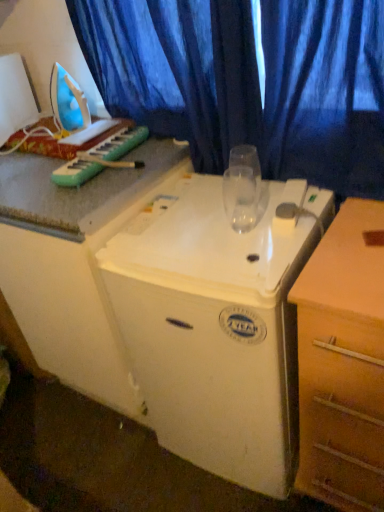
Question: Which direction should I rotate to face white plastic refrigerator at center, the first appliance from the bottom, — up or down?

Choices:
 (A) up
 (B) down

Answer: (B)

Question: Considering the relative sizes of green plastic musical keyboard at upper left and wooden chest of drawers at right in the image provided, is green plastic musical keyboard at upper left shorter than wooden chest of drawers at right?

Choices:
 (A) no
 (B) yes

Answer: (B)

Question: Is green plastic musical keyboard at upper left far away from wooden chest of drawers at right?

Choices:
 (A) yes
 (B) no

Answer: (B)

Question: Can we say green plastic musical keyboard at upper left lies outside wooden chest of drawers at right?

Choices:
 (A) no
 (B) yes

Answer: (B)

Question: Is green plastic musical keyboard at upper left bigger than wooden chest of drawers at right?

Choices:
 (A) no
 (B) yes

Answer: (A)

Question: Does green plastic musical keyboard at upper left come behind wooden chest of drawers at right?

Choices:
 (A) no
 (B) yes

Answer: (B)

Question: Considering the relative sizes of green plastic musical keyboard at upper left and wooden chest of drawers at right in the image provided, is green plastic musical keyboard at upper left smaller than wooden chest of drawers at right?

Choices:
 (A) yes
 (B) no

Answer: (A)

Question: Is transparent glass at center far away from wooden chest of drawers at right?

Choices:
 (A) no
 (B) yes

Answer: (A)

Question: From a real-world perspective, is transparent glass at center on top of wooden chest of drawers at right?

Choices:
 (A) yes
 (B) no

Answer: (A)

Question: Is wooden chest of drawers at right inside transparent glass at center?

Choices:
 (A) no
 (B) yes

Answer: (A)

Question: Considering the relative sizes of transparent glass at center and wooden chest of drawers at right in the image provided, is transparent glass at center thinner than wooden chest of drawers at right?

Choices:
 (A) yes
 (B) no

Answer: (A)

Question: From the image's perspective, would you say transparent glass at center is positioned over wooden chest of drawers at right?

Choices:
 (A) yes
 (B) no

Answer: (A)

Question: Is transparent glass at center positioned behind wooden chest of drawers at right?

Choices:
 (A) no
 (B) yes

Answer: (B)

Question: Is white plastic iron at left, which appears as the 1th appliance when viewed from the top, positioned in front of transparent glass at center?

Choices:
 (A) no
 (B) yes

Answer: (A)